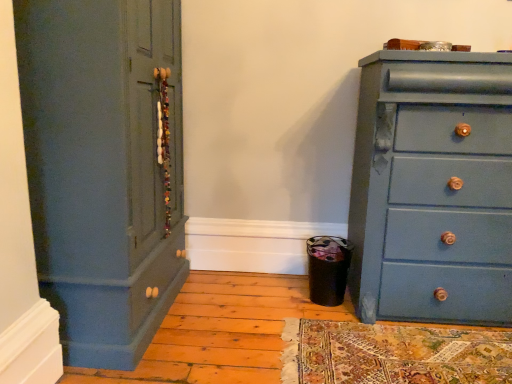
Find the location of a particular element. This screenshot has width=512, height=384. matte blue dresser at right is located at coordinates (433, 188).

The width and height of the screenshot is (512, 384). What do you see at coordinates (433, 188) in the screenshot?
I see `matte blue dresser at right` at bounding box center [433, 188].

Locate an element on the screen. The height and width of the screenshot is (384, 512). matte blue cupboard at left is located at coordinates (104, 168).

The width and height of the screenshot is (512, 384). Describe the element at coordinates (104, 168) in the screenshot. I see `matte blue cupboard at left` at that location.

At what (x,y) coordinates should I click in order to perform the action: click on matte blue dresser at right. Please return your answer as a coordinate pair (x, y). The image size is (512, 384). Looking at the image, I should click on (433, 188).

Can you confirm if matte blue cupboard at left is positioned to the left of matte blue dresser at right?

Yes.

Is matte blue cupboard at left behind matte blue dresser at right?

No, it is not.

Which is closer, (65, 315) or (399, 124)?

Point (65, 315) is closer to the camera than point (399, 124).

From the image's perspective, between matte blue cupboard at left and matte blue dresser at right, who is located below?

matte blue dresser at right, from the image's perspective.

From a real-world perspective, is matte blue cupboard at left positioned over matte blue dresser at right based on gravity?

Yes.

Looking at their sizes, would you say matte blue cupboard at left is wider or thinner than matte blue dresser at right?

matte blue cupboard at left is wider than matte blue dresser at right.

In the scene shown: In terms of height, does matte blue cupboard at left look taller or shorter compared to matte blue dresser at right?

Considering their sizes, matte blue cupboard at left has more height than matte blue dresser at right.

Looking at this image, is matte blue cupboard at left bigger than matte blue dresser at right?

Yes, matte blue cupboard at left is bigger than matte blue dresser at right.

Is matte blue dresser at right completely or partially inside matte blue cupboard at left?

No, matte blue cupboard at left does not contain matte blue dresser at right.

Is matte blue cupboard at left placed right next to matte blue dresser at right?

matte blue cupboard at left and matte blue dresser at right are not in contact.

Is matte blue cupboard at left turned away from matte blue dresser at right?

matte blue cupboard at left is not turned away from matte blue dresser at right.

What's the angular difference between matte blue cupboard at left and matte blue dresser at right's facing directions?

matte blue cupboard at left and matte blue dresser at right are facing 89.9 degrees away from each other.

Measure the distance from matte blue cupboard at left to matte blue dresser at right.

A distance of 1.12 meters exists between matte blue cupboard at left and matte blue dresser at right.

This screenshot has width=512, height=384. I want to click on the chest of drawers below the matte blue cupboard at left (from a real-world perspective), so click(x=433, y=188).

Which is more to the right, matte blue dresser at right or matte blue cupboard at left?

Positioned to the right is matte blue dresser at right.

Who is more distant, matte blue dresser at right or matte blue cupboard at left?

matte blue dresser at right.

Considering the points (429, 316) and (101, 118), which point is behind, point (429, 316) or point (101, 118)?

The point (429, 316) is more distant.

From the image's perspective, who appears lower, matte blue dresser at right or matte blue cupboard at left?

matte blue dresser at right is shown below in the image.

Consider the image. From a real-world perspective, is matte blue dresser at right on matte blue cupboard at left?

No, from a real-world perspective, matte blue dresser at right is not on top of matte blue cupboard at left.

Considering the relative sizes of matte blue dresser at right and matte blue cupboard at left in the image provided, is matte blue dresser at right wider than matte blue cupboard at left?

Incorrect, the width of matte blue dresser at right does not surpass that of matte blue cupboard at left.

Considering the sizes of objects matte blue dresser at right and matte blue cupboard at left in the image provided, who is taller, matte blue dresser at right or matte blue cupboard at left?

With more height is matte blue cupboard at left.

Looking at the image, does matte blue dresser at right seem bigger or smaller compared to matte blue cupboard at left?

Clearly, matte blue dresser at right is smaller in size than matte blue cupboard at left.

Is matte blue dresser at right not inside matte blue cupboard at left?

Yes.

Is matte blue dresser at right next to matte blue cupboard at left?

There is a gap between matte blue dresser at right and matte blue cupboard at left.

Is matte blue dresser at right positioned with its back to matte blue cupboard at left?

No, matte blue dresser at right is not facing the opposite direction of matte blue cupboard at left.

Can you tell me how much matte blue dresser at right and matte blue cupboard at left differ in facing direction?

The angular difference between matte blue dresser at right and matte blue cupboard at left is 89.9 degrees.

You are a GUI agent. You are given a task and a screenshot of the screen. Output one action in this format:
    pyautogui.click(x=<x>, y=<y>)
    Task: Click on the chest of drawers that appears behind the matte blue cupboard at left
    
    Given the screenshot: What is the action you would take?
    pyautogui.click(x=433, y=188)

You are a GUI agent. You are given a task and a screenshot of the screen. Output one action in this format:
    pyautogui.click(x=<x>, y=<y>)
    Task: Click on the cupboard located in front of the matte blue dresser at right
    This screenshot has width=512, height=384.
    Given the screenshot: What is the action you would take?
    pyautogui.click(x=104, y=168)

You are a GUI agent. You are given a task and a screenshot of the screen. Output one action in this format:
    pyautogui.click(x=<x>, y=<y>)
    Task: Click on the chest of drawers on the right of the matte blue cupboard at left
    This screenshot has height=384, width=512.
    Given the screenshot: What is the action you would take?
    pyautogui.click(x=433, y=188)